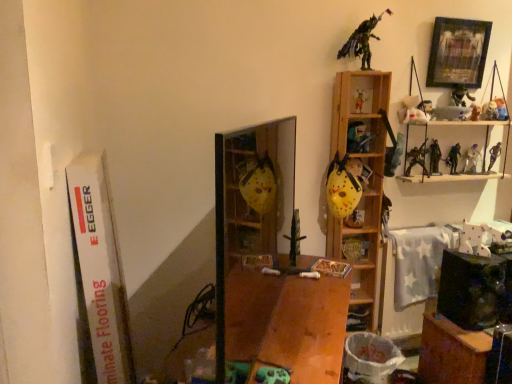
Question: Considering the relative positions of metallic sword at center, which is the 15th toy in right-to-left order, and plush teddy bear at upper right, arranged as the fifteenth toy when viewed from the left, in the image provided, is metallic sword at center, which is the 15th toy in right-to-left order, behind plush teddy bear at upper right, arranged as the fifteenth toy when viewed from the left,?

Choices:
 (A) yes
 (B) no

Answer: (B)

Question: Is metallic sword at center, acting as the first toy starting from the left, to the right of plush teddy bear at upper right, arranged as the first toy when viewed from the right, from the viewer's perspective?

Choices:
 (A) yes
 (B) no

Answer: (B)

Question: Are metallic sword at center, acting as the first toy starting from the left, and plush teddy bear at upper right, arranged as the first toy when viewed from the right, beside each other?

Choices:
 (A) no
 (B) yes

Answer: (A)

Question: Is plush teddy bear at upper right, arranged as the fifteenth toy when viewed from the left, located within metallic sword at center, which is the 15th toy in right-to-left order?

Choices:
 (A) no
 (B) yes

Answer: (A)

Question: Does metallic sword at center, which is the 15th toy in right-to-left order, have a smaller size compared to plush teddy bear at upper right, arranged as the fifteenth toy when viewed from the left?

Choices:
 (A) yes
 (B) no

Answer: (B)

Question: Looking at the image, does wooden book at center seem bigger or smaller compared to yellow matte mask at center, acting as the third cabinet starting from the front?

Choices:
 (A) big
 (B) small

Answer: (B)

Question: Does point (331, 271) appear closer or farther from the camera than point (349, 165)?

Choices:
 (A) farther
 (B) closer

Answer: (B)

Question: Visually, is wooden book at center positioned to the left or to the right of yellow matte mask at center, acting as the first cabinet starting from the back?

Choices:
 (A) right
 (B) left

Answer: (B)

Question: Is wooden book at center inside or outside of yellow matte mask at center, which ranks as the second cabinet in left-to-right order?

Choices:
 (A) inside
 (B) outside

Answer: (B)

Question: Choose the correct answer: Is matte yellow mask at upper center, which is counted as the 12th toy, starting from the right, inside metallic silver figure at upper right, positioned as the seventh toy in right-to-left order, or outside it?

Choices:
 (A) inside
 (B) outside

Answer: (B)

Question: Considering the positions of matte yellow mask at upper center, which appears as the fourth toy when viewed from the left, and metallic silver figure at upper right, marked as the ninth toy in a left-to-right arrangement, in the image, is matte yellow mask at upper center, which appears as the fourth toy when viewed from the left, bigger or smaller than metallic silver figure at upper right, marked as the ninth toy in a left-to-right arrangement,?

Choices:
 (A) small
 (B) big

Answer: (A)

Question: Based on their positions, is matte yellow mask at upper center, which appears as the fourth toy when viewed from the left, located to the left or right of metallic silver figure at upper right, marked as the ninth toy in a left-to-right arrangement?

Choices:
 (A) right
 (B) left

Answer: (B)

Question: From a real-world perspective, is matte yellow mask at upper center, which is counted as the 12th toy, starting from the right, above or below metallic silver figure at upper right, marked as the ninth toy in a left-to-right arrangement?

Choices:
 (A) below
 (B) above

Answer: (B)

Question: Relative to metallic silver figure at upper right, marked as the ninth toy in a left-to-right arrangement, is white matte plush toy at upper right, which appears as the 8th toy when viewed from the right, in front or behind?

Choices:
 (A) front
 (B) behind

Answer: (A)

Question: Is white matte plush toy at upper right, the eighth toy viewed from the left, taller or shorter than metallic silver figure at upper right, marked as the ninth toy in a left-to-right arrangement?

Choices:
 (A) tall
 (B) short

Answer: (B)